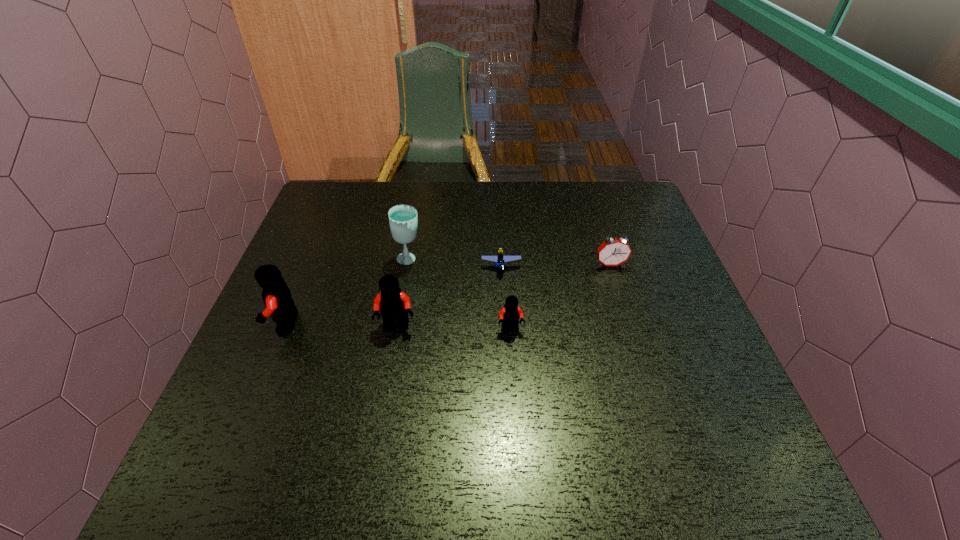
This screenshot has width=960, height=540. Identify the location of vacant area located on the clock face of the alarm clock. (641, 364).

You are a GUI agent. You are given a task and a screenshot of the screen. Output one action in this format:
    pyautogui.click(x=<x>, y=<y>)
    Task: Click on the blank space located 0.180m on the right of the glass
    The width and height of the screenshot is (960, 540).
    Given the screenshot: What is the action you would take?
    pyautogui.click(x=489, y=259)

Locate an element on the screen. The image size is (960, 540). object at the left edge is located at coordinates (276, 295).

At what (x,y) coordinates should I click in order to perform the action: click on object at the right edge. Please return your answer as a coordinate pair (x, y). This screenshot has height=540, width=960. Looking at the image, I should click on (613, 251).

Where is `free space at the far edge`? This screenshot has height=540, width=960. free space at the far edge is located at coordinates (382, 206).

Locate an element on the screen. Image resolution: width=960 pixels, height=540 pixels. free point at the near edge is located at coordinates (588, 396).

Identify the location of free space at the right edge. The height and width of the screenshot is (540, 960). (644, 290).

Find the location of a particular element. The image size is (960, 540). free space at the far left corner is located at coordinates (356, 223).

The width and height of the screenshot is (960, 540). I want to click on blank space at the near left corner, so click(x=229, y=420).

What are the coordinates of `vacant space in between the third tallest Lego and the second Lego from left to right` in the screenshot? It's located at (454, 328).